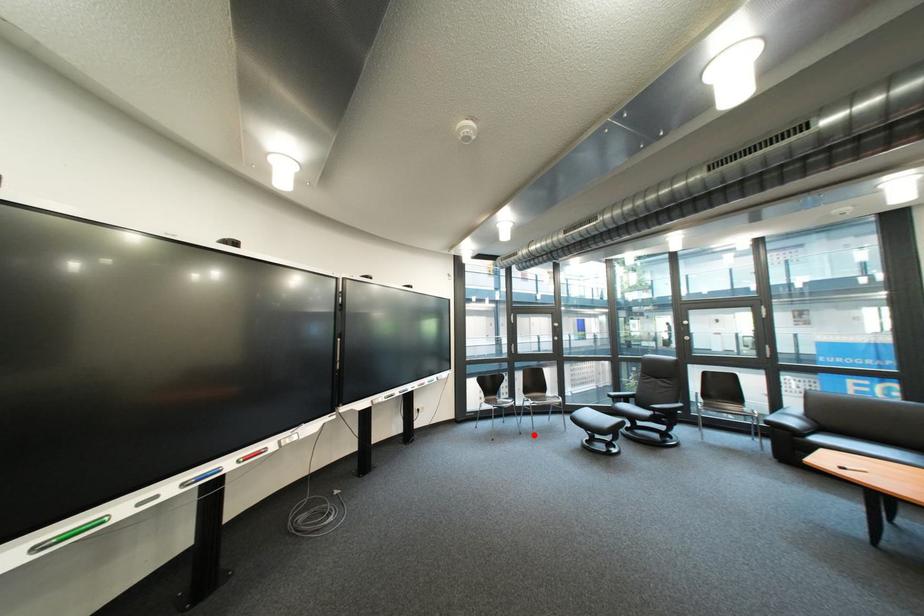
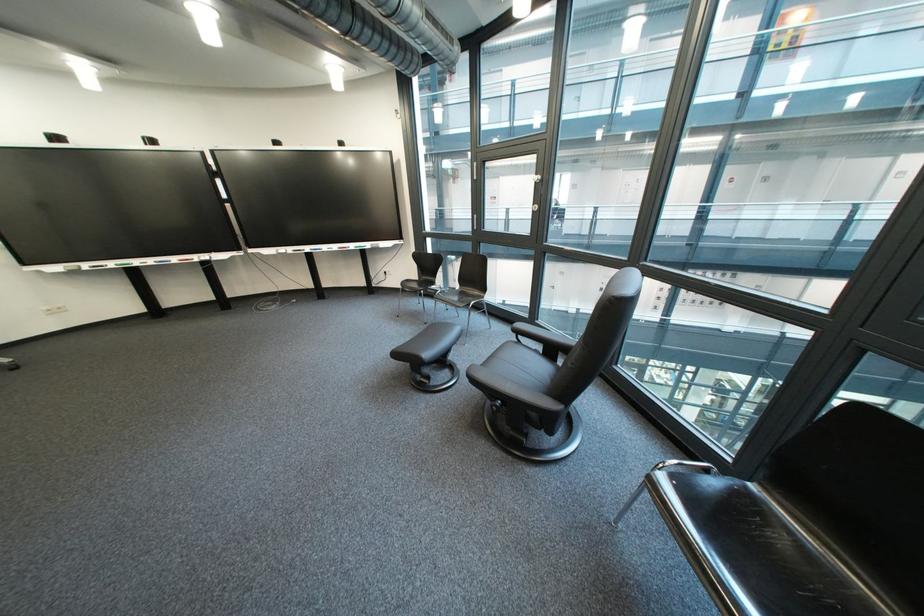
Question: I am providing you with two images of the same scene from different viewpoints. Given a red point in image1, look at the same physical point in image2. Is it:

Choices:
 (A) Closer to the viewpoint
 (B) Farther from the viewpoint

Answer: (A)